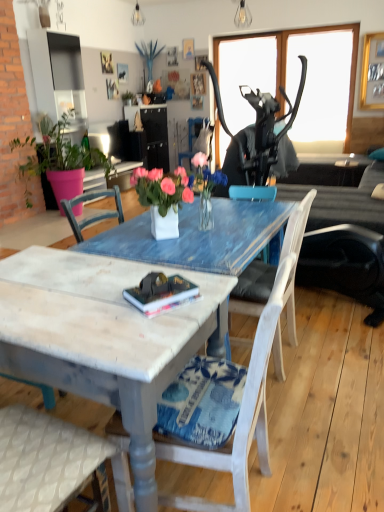
Identify the location of blank space above distressed wood coffee table at lower center (from a real-world perspective). The width and height of the screenshot is (384, 512). (76, 287).